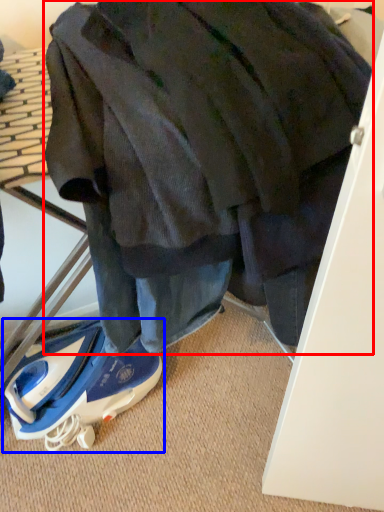
Question: Which object appears closest to the camera in this image, jacket (highlighted by a red box) or footwear (highlighted by a blue box)?

Choices:
 (A) jacket
 (B) footwear

Answer: (A)